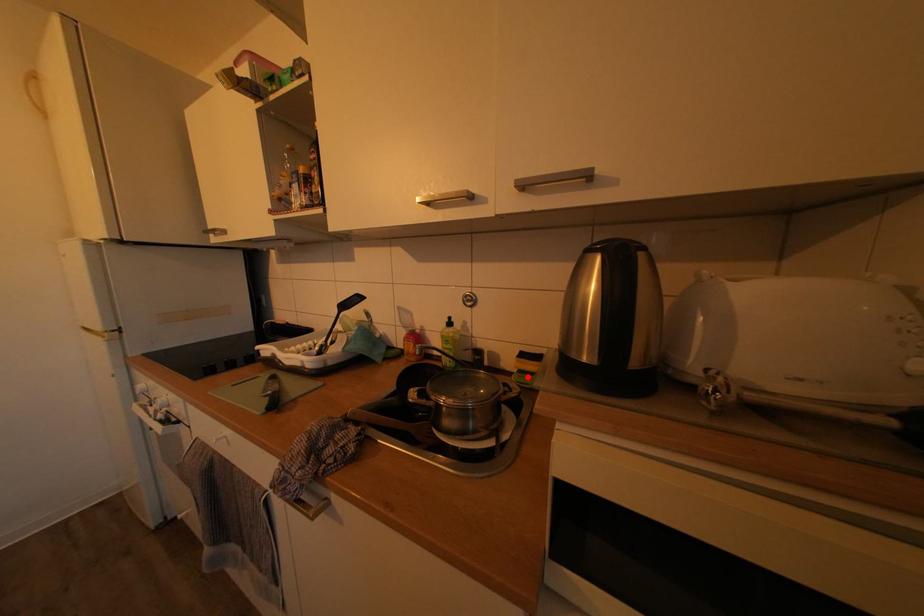
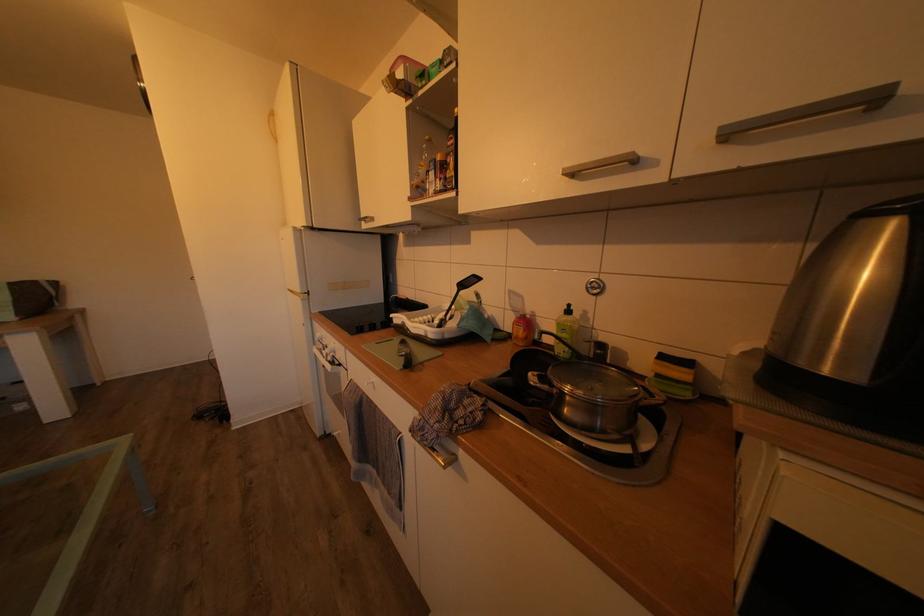
Locate, in the second image, the point that corresponds to the highlighted location in the first image.

(666, 382)